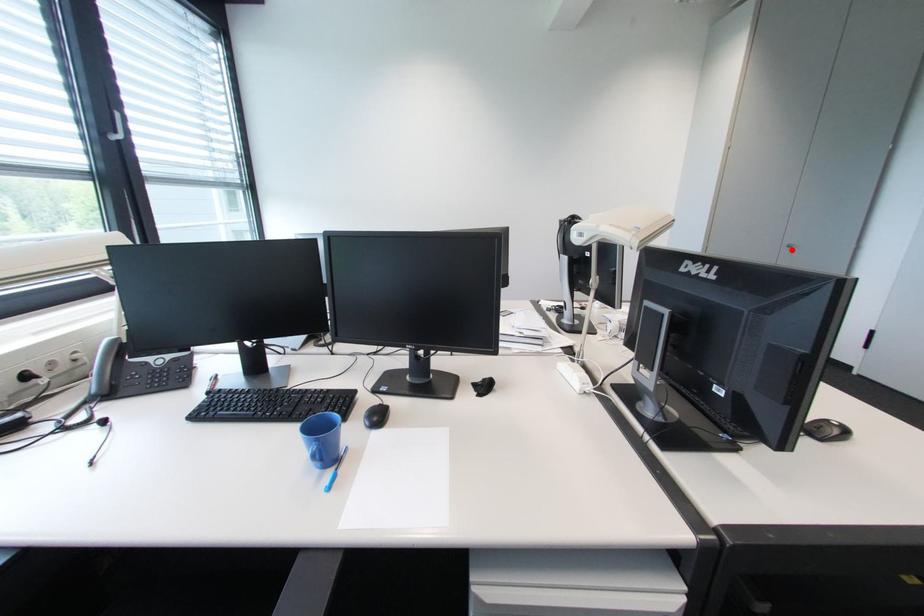
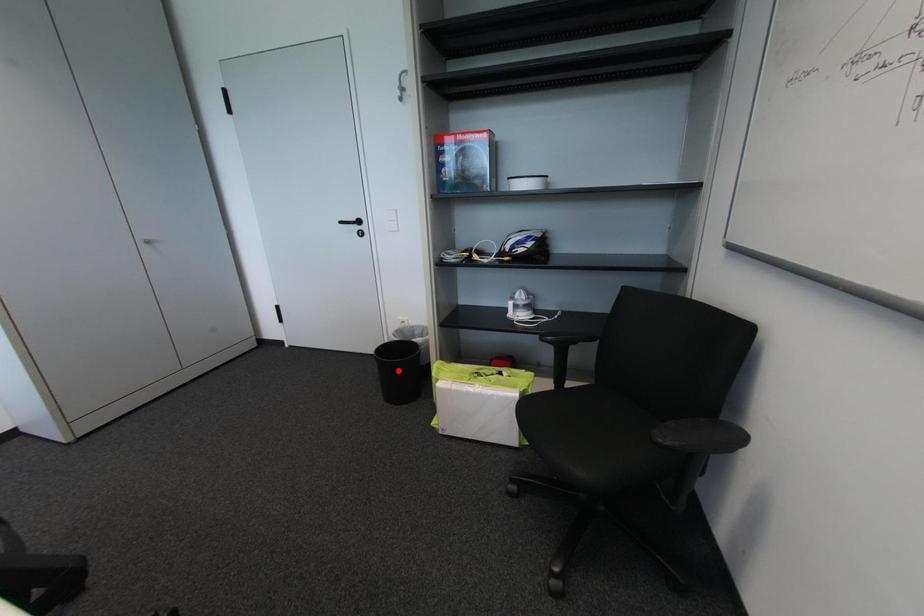
I am providing you with two images of the same scene from different viewpoints. A red point is marked on the first image and another point is marked on the second image. Are the points marked in image1 and image2 representing the same 3D position?

No